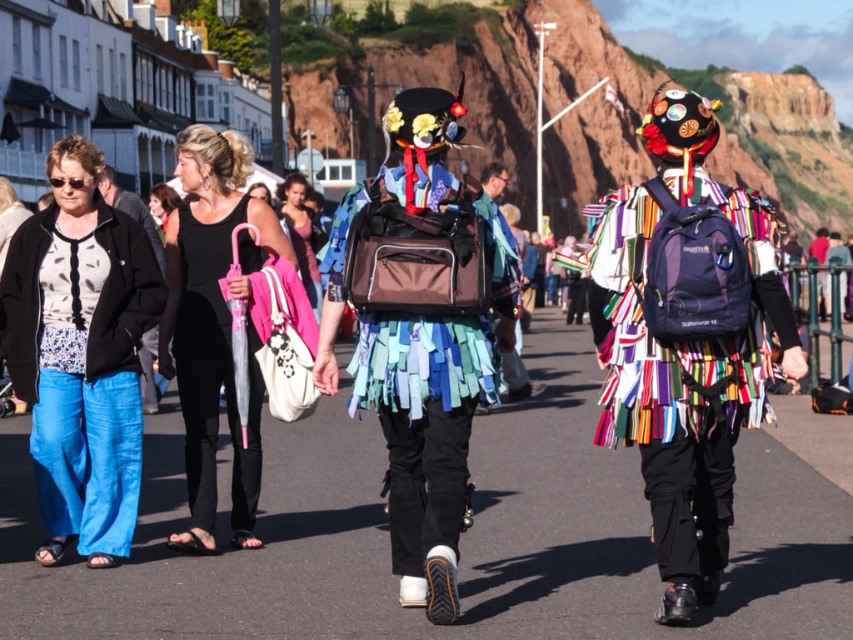
Question: Is denim pants at left below multicolored fabric backpack at center?

Choices:
 (A) yes
 (B) no

Answer: (B)

Question: Which is farther from the denim pants at left?

Choices:
 (A) matte pink top at center
 (B) multicolored fabric backpack at center
 (C) textured fabric skirt at center
 (D) black fabric dress at center

Answer: (A)

Question: Estimate the real-world distances between objects in this image. Which object is closer to the textured fabric skirt at center?

Choices:
 (A) multicolored fabric backpack at center
 (B) black fabric dress at center
 (C) matte pink top at center
 (D) denim pants at left

Answer: (A)

Question: Based on their relative distances, which object is farther from the denim pants at left?

Choices:
 (A) matte pink top at center
 (B) textured fabric skirt at center

Answer: (A)

Question: Is multicolored fabric backpack at center thinner than textured fabric skirt at center?

Choices:
 (A) yes
 (B) no

Answer: (B)

Question: Is multicolored fabric backpack at center below textured fabric skirt at center?

Choices:
 (A) no
 (B) yes

Answer: (B)